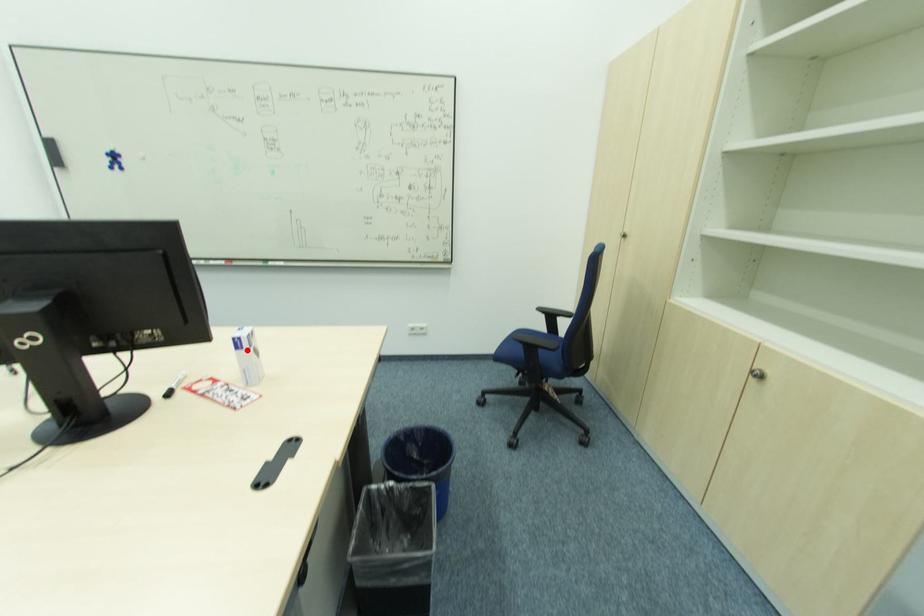
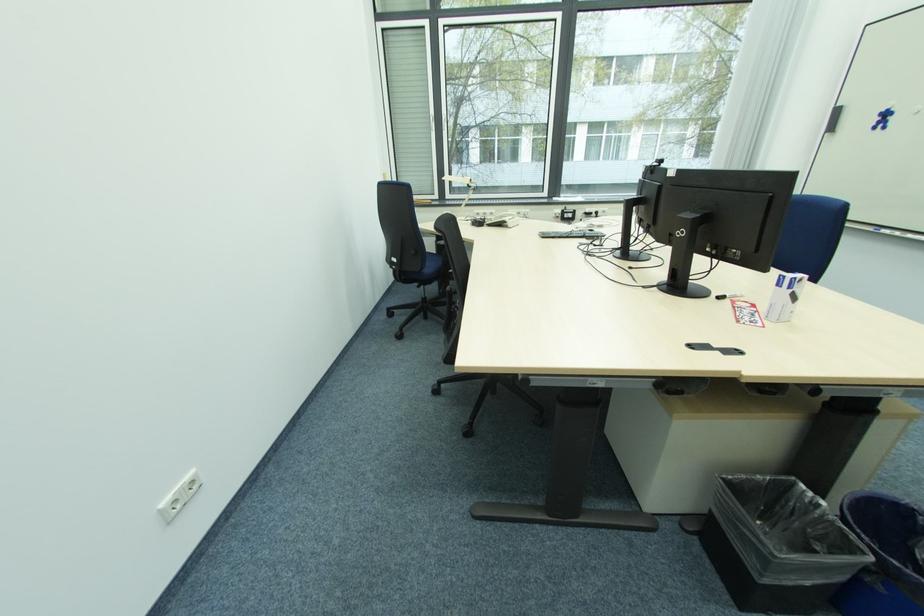
Locate, in the second image, the point that corresponds to the highlighted location in the first image.

(784, 288)